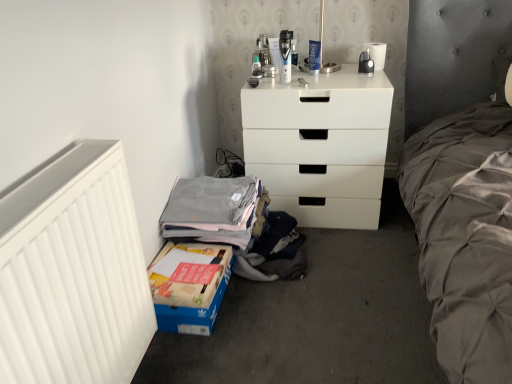
The height and width of the screenshot is (384, 512). In order to click on free location in front of white matte chest of drawers at center in this screenshot , I will do `click(345, 264)`.